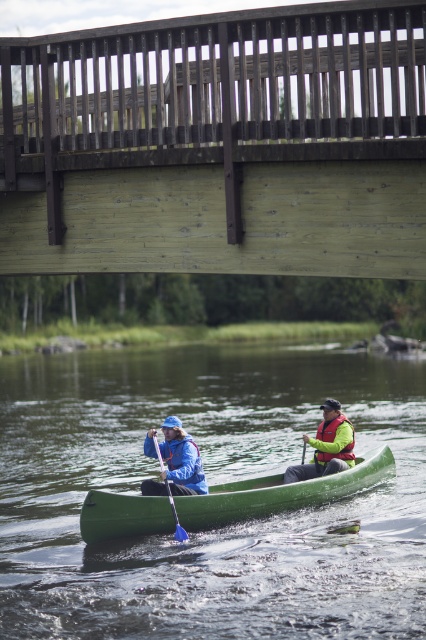
Does green matte canoe at center appear over yellow matte life jacket at center?

No.

Locate an element on the screen. This screenshot has height=640, width=426. green matte canoe at center is located at coordinates (279, 493).

Between point (83, 522) and point (351, 448), which one is positioned in front?

Point (83, 522) is in front.

Where is `green matte canoe at center`? green matte canoe at center is located at coordinates (279, 493).

Is wooden bridge at upper center above green life jacket at center?

Correct, wooden bridge at upper center is located above green life jacket at center.

Who is shorter, wooden bridge at upper center or green life jacket at center?

With less height is green life jacket at center.

Identify the location of wooden bridge at upper center. (218, 144).

Identify the location of wooden bridge at upper center. This screenshot has width=426, height=640. (218, 144).

Which is in front, point (334, 420) or point (170, 497)?

Point (170, 497)

Locate an element on the screen. green life jacket at center is located at coordinates [x=327, y=445].

Where is `green life jacket at center`? The image size is (426, 640). green life jacket at center is located at coordinates (327, 445).